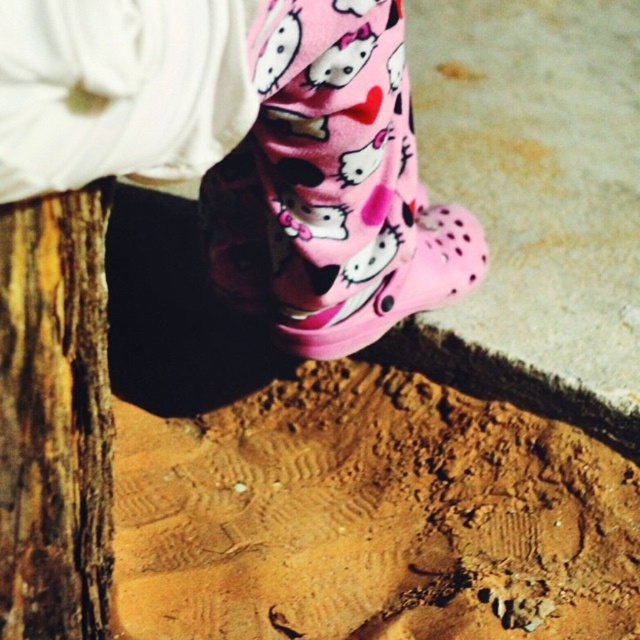
Between point (72, 401) and point (467, 259), which one is positioned in front?

Point (72, 401)

Is point (56, 364) more distant than point (449, 209)?

No, it is in front of (449, 209).

Does point (4, 508) come farther from viewer compared to point (448, 273)?

No, it is not.

Locate an element on the screen. The image size is (640, 640). rough bark tree trunk at lower left is located at coordinates (54, 417).